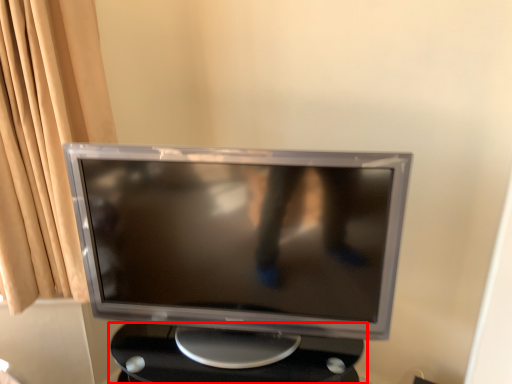
Question: From the image's perspective, where is table (annotated by the red box) located relative to computer monitor?

Choices:
 (A) below
 (B) above

Answer: (A)